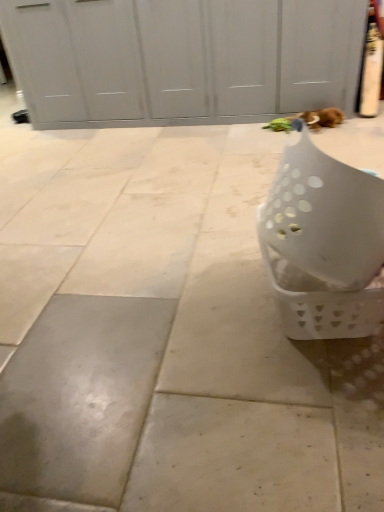
Question: Based on their positions, is brown plush cat at upper right located to the left or right of white plastic basket at lower right?

Choices:
 (A) right
 (B) left

Answer: (A)

Question: Looking at the image, does brown plush cat at upper right seem bigger or smaller compared to white plastic basket at lower right?

Choices:
 (A) small
 (B) big

Answer: (A)

Question: From a real-world perspective, is brown plush cat at upper right positioned above or below white plastic basket at lower right?

Choices:
 (A) below
 (B) above

Answer: (A)

Question: Do you think white plastic basket at lower right is within brown plush cat at upper right, or outside of it?

Choices:
 (A) outside
 (B) inside

Answer: (A)

Question: Is white plastic basket at lower right taller or shorter than brown plush cat at upper right?

Choices:
 (A) tall
 (B) short

Answer: (A)

Question: In the image, is white plastic basket at lower right positioned in front of or behind brown plush cat at upper right?

Choices:
 (A) behind
 (B) front

Answer: (B)

Question: From a real-world perspective, is white plastic basket at lower right above or below brown plush cat at upper right?

Choices:
 (A) above
 (B) below

Answer: (A)